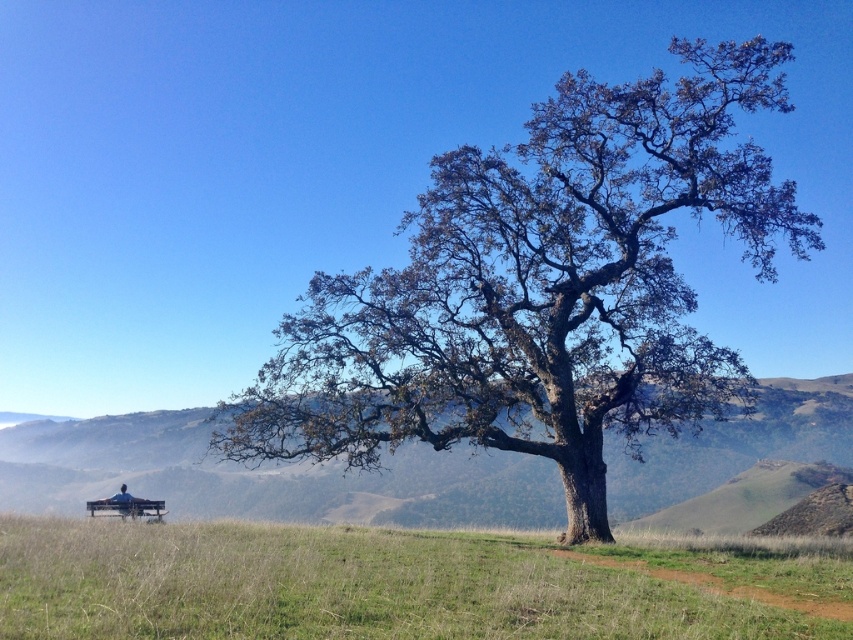
Does green-brown bark tree at center appear under green grassy at center?

No, green-brown bark tree at center is not below green grassy at center.

Who is more forward, (300,369) or (137,525)?

Positioned in front is point (137,525).

Does point (608, 337) come behind point (131, 547)?

That is True.

Image resolution: width=853 pixels, height=640 pixels. I want to click on green-brown bark tree at center, so click(x=541, y=289).

Can you confirm if green-brown bark tree at center is bigger than green grassy hill at lower left?

Yes.

Can you confirm if green-brown bark tree at center is positioned below green grassy hill at lower left?

Incorrect, green-brown bark tree at center is not positioned below green grassy hill at lower left.

Which is behind, point (706, 344) or point (723, 460)?

Point (723, 460)

What are the coordinates of `green-brown bark tree at center` in the screenshot? It's located at (541, 289).

At what (x,y) coordinates should I click in order to perform the action: click on green grassy at center. Please return your answer as a coordinate pair (x, y). Looking at the image, I should click on (397, 582).

This screenshot has height=640, width=853. Identify the location of green grassy at center. (397, 582).